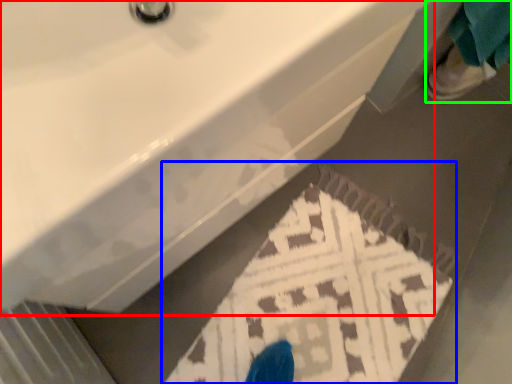
Question: Which is farther away from sink (highlighted by a red box)? doormat (highlighted by a blue box) or person (highlighted by a green box)?

Choices:
 (A) doormat
 (B) person

Answer: (B)